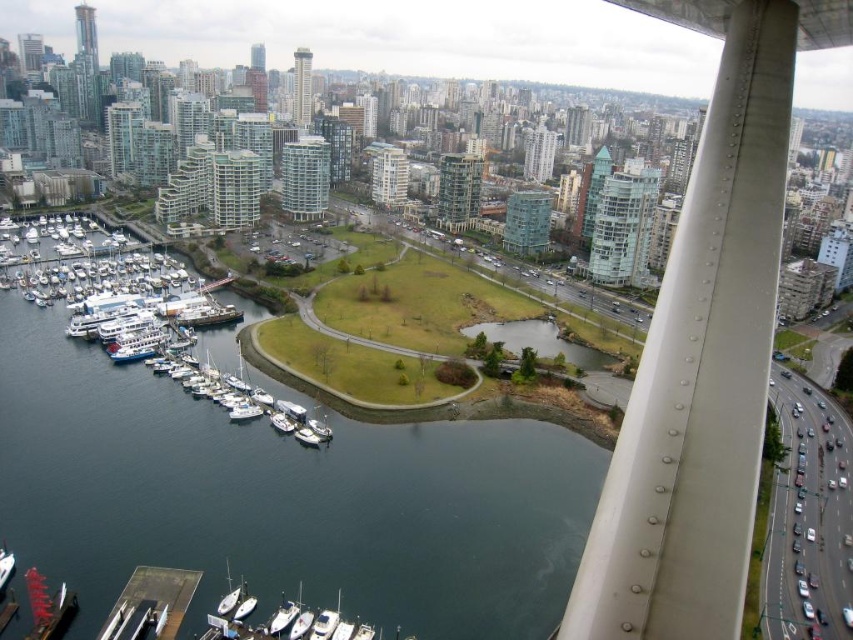
You are standing at the point with coordinates point (122, 628) and want to walk towards the point with coordinates point (170, 316). According to the scene description, will you be moving towards the foreground or the background?

According to the scene description, point (170, 316) is behind point (122, 628). Therefore, moving from point (122, 628) towards point (170, 316) means you are moving towards the background.

You are planning to take a group of 10 people on a short cruise. You see two boats available in the image, the white matte sailboat at lower center and the white matte boat at lower center. Which one can accommodate more passengers?

The white matte sailboat at lower center has a larger size compared to the white matte boat at lower center, so it can accommodate more passengers.

You are standing at the viewpoint overlooking the waterfront and want to determine which of the two points, point 1 at coordinates point (291,426) or point 2 at coordinates point (308,432), is closer to you. Which point is closer?

Point (291,426) is closer to you because it is further to the viewer than point (308,432).